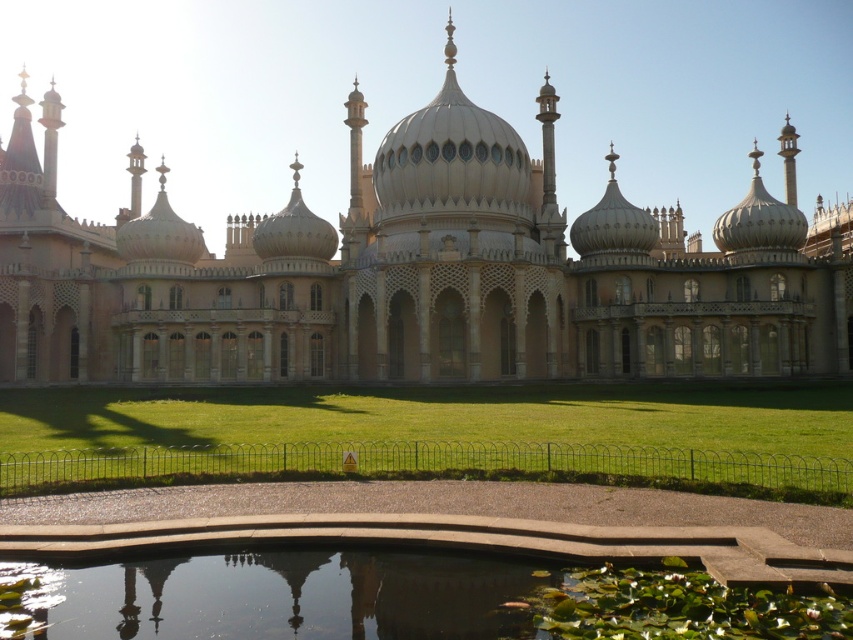
Can you confirm if beige stone palace at center is smaller than white marble dome at center?

Incorrect, beige stone palace at center is not smaller in size than white marble dome at center.

How distant is beige stone palace at center from white marble dome at center?

beige stone palace at center and white marble dome at center are 8.92 meters apart.

Is point (523, 212) behind point (508, 156)?

No, it is in front of (508, 156).

Image resolution: width=853 pixels, height=640 pixels. Find the location of `beige stone palace at center`. beige stone palace at center is located at coordinates (413, 269).

Describe the element at coordinates (277, 596) in the screenshot. The height and width of the screenshot is (640, 853). I see `transparent glass pond at center` at that location.

Between transparent glass pond at center and white marble dome at center, which one appears on the left side from the viewer's perspective?

transparent glass pond at center

Between point (500, 620) and point (505, 131), which one is positioned in front?

Point (500, 620) is in front.

Identify the location of transparent glass pond at center. (277, 596).

Which is behind, point (453, 326) or point (207, 458)?

Point (453, 326)

The height and width of the screenshot is (640, 853). Identify the location of beige stone palace at center. (413, 269).

Locate an element on the screen. The image size is (853, 640). beige stone palace at center is located at coordinates (413, 269).